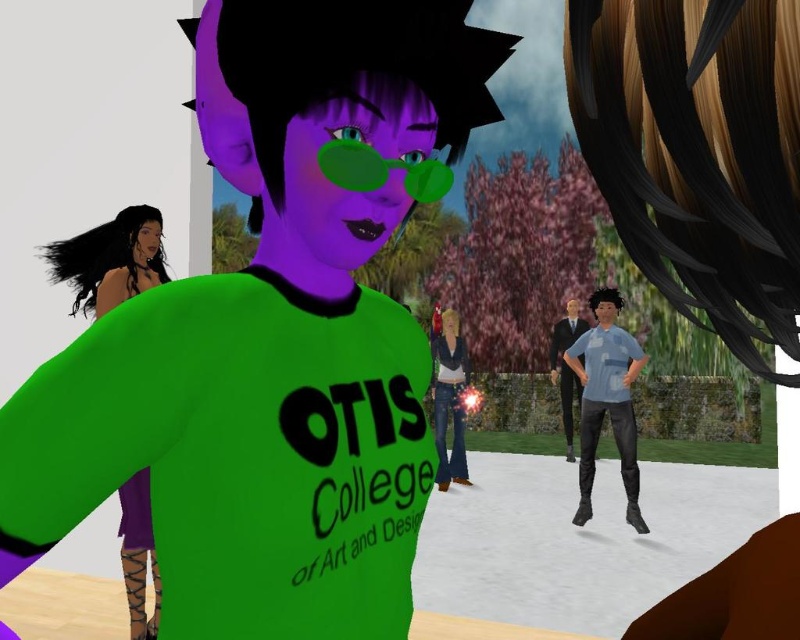
Question: Estimate the real-world distances between objects in this image. Which object is farther from the light blue denim jeans at center?

Choices:
 (A) purple matte dress at left
 (B) denim jeans at center
 (C) light blue fabric shirt at center

Answer: (A)

Question: Which of the following is the farthest from the observer?

Choices:
 (A) (448, 458)
 (B) (134, 205)
 (C) (632, 449)
 (D) (564, 388)

Answer: (D)

Question: Is purple matte dress at left further to the viewer compared to denim jeans at center?

Choices:
 (A) no
 (B) yes

Answer: (A)

Question: Which object is the farthest from the purple matte dress at left?

Choices:
 (A) denim jeans at center
 (B) light blue fabric shirt at center

Answer: (A)

Question: Does purple matte dress at left appear over light blue denim jeans at center?

Choices:
 (A) yes
 (B) no

Answer: (A)

Question: Is purple matte dress at left above denim jeans at center?

Choices:
 (A) yes
 (B) no

Answer: (A)